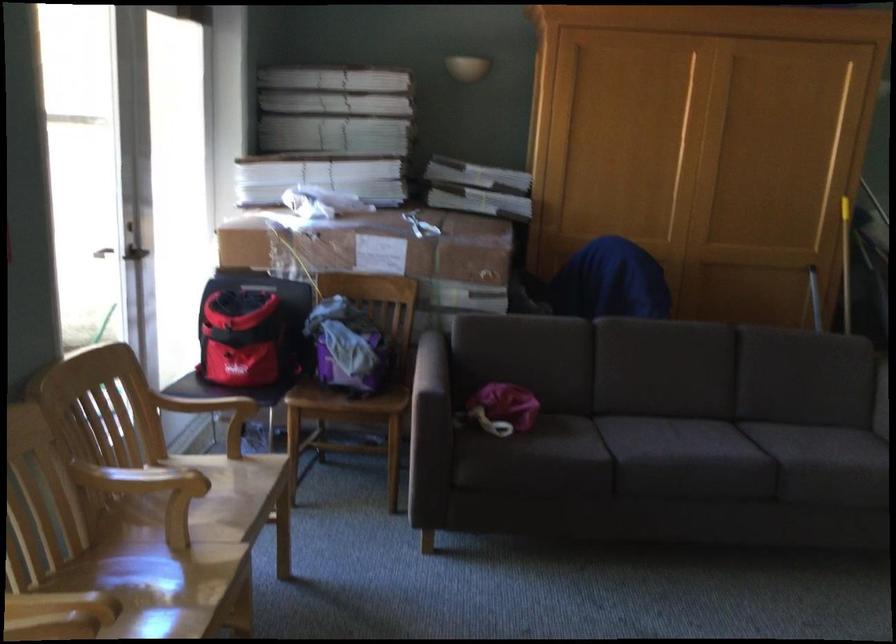
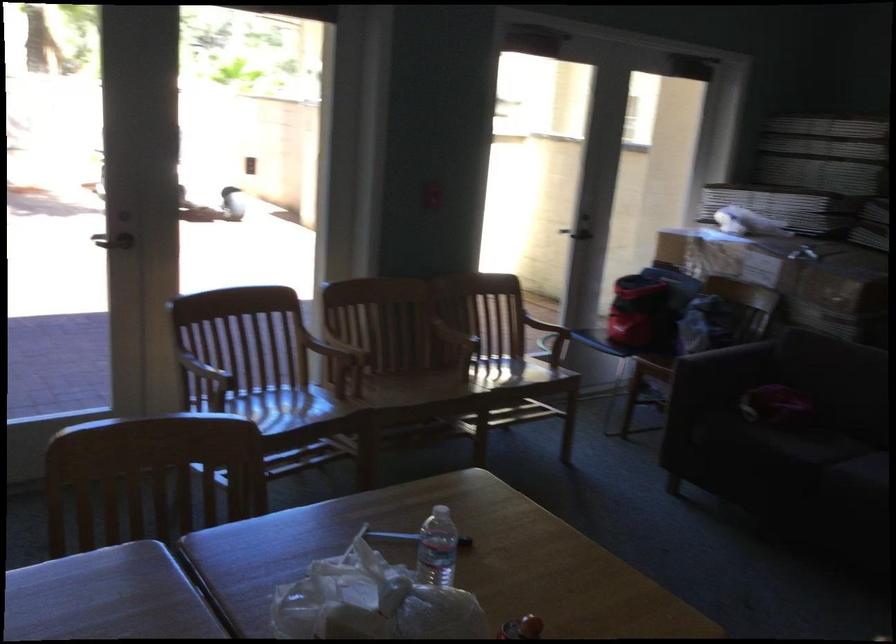
The point at (455, 563) is marked in the first image. Where is the corresponding point in the second image?

(673, 488)